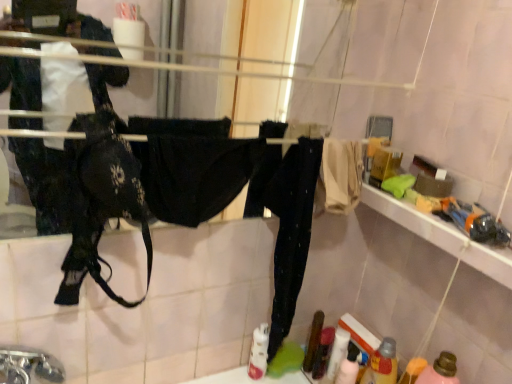
Question: In terms of size, does translucent plastic bottle at lower right, positioned as the 1th bottle in left-to-right order, appear bigger or smaller than silver metallic faucet at lower left?

Choices:
 (A) big
 (B) small

Answer: (B)

Question: In the image, is translucent plastic bottle at lower right, which ranks as the 2th bottle in right-to-left order, on the left side or the right side of silver metallic faucet at lower left?

Choices:
 (A) right
 (B) left

Answer: (A)

Question: Which of these objects is positioned closest to the pink matte bottle at lower right, placed as the first bottle when sorted from right to left?

Choices:
 (A) silver metallic faucet at lower left
 (B) translucent plastic bottle at lower right, positioned as the 1th bottle in left-to-right order

Answer: (B)

Question: Estimate the real-world distances between objects in this image. Which object is farther from the pink matte bottle at lower right, which is counted as the 2th bottle, starting from the left?

Choices:
 (A) translucent plastic bottle at lower right, which ranks as the 2th bottle in right-to-left order
 (B) silver metallic faucet at lower left

Answer: (B)